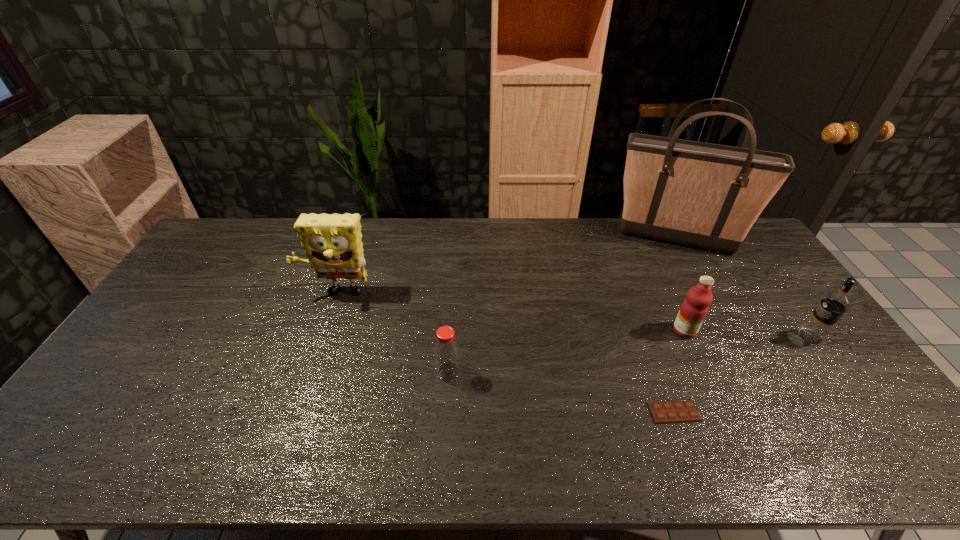
What are the coordinates of `vodka at the right edge` in the screenshot? It's located at (835, 303).

You are a GUI agent. You are given a task and a screenshot of the screen. Output one action in this format:
    pyautogui.click(x=<x>, y=<y>)
    Task: Click on the object that is at the far right corner
    The width and height of the screenshot is (960, 540).
    Given the screenshot: What is the action you would take?
    pyautogui.click(x=707, y=196)

Find the location of a particular element. The width and height of the screenshot is (960, 540). vacant space at the far edge of the desktop is located at coordinates (519, 233).

In the image, there is a desktop. Where is `vacant space at the near edge`? Image resolution: width=960 pixels, height=540 pixels. vacant space at the near edge is located at coordinates (309, 449).

Locate an element on the screen. Image resolution: width=960 pixels, height=540 pixels. vacant space at the left edge of the desktop is located at coordinates (160, 322).

You are a GUI agent. You are given a task and a screenshot of the screen. Output one action in this format:
    pyautogui.click(x=<x>, y=<y>)
    Task: Click on the vacant space at the right edge of the desktop
    This screenshot has height=540, width=960.
    Given the screenshot: What is the action you would take?
    pyautogui.click(x=815, y=377)

Identify the location of blank area at the far left corner. (230, 220).

This screenshot has height=540, width=960. In order to click on blank region between the shopping bag and the vodka in this screenshot , I will do coord(743,288).

Where is `vacant space in between the fifth shortest object and the tallest object`? This screenshot has width=960, height=540. vacant space in between the fifth shortest object and the tallest object is located at coordinates (506, 266).

I want to click on free spot between the fruit juice and the vodka, so point(748,334).